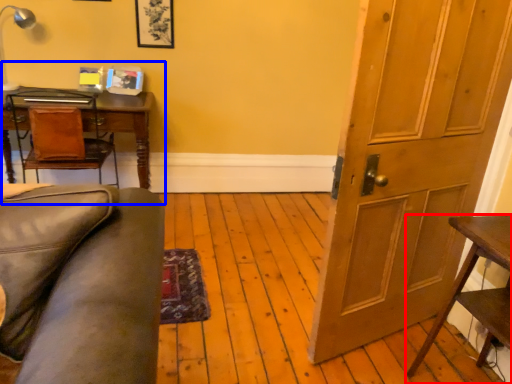
Question: Which object appears farthest to the camera in this image, table (highlighted by a red box) or computer desk (highlighted by a blue box)?

Choices:
 (A) table
 (B) computer desk

Answer: (B)